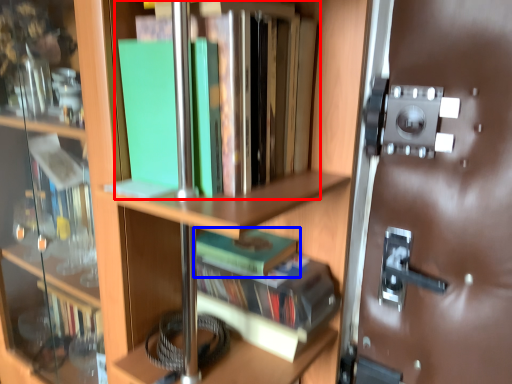
Question: Which object appears closest to the camera in this image, book (highlighted by a red box) or book (highlighted by a blue box)?

Choices:
 (A) book
 (B) book

Answer: (A)